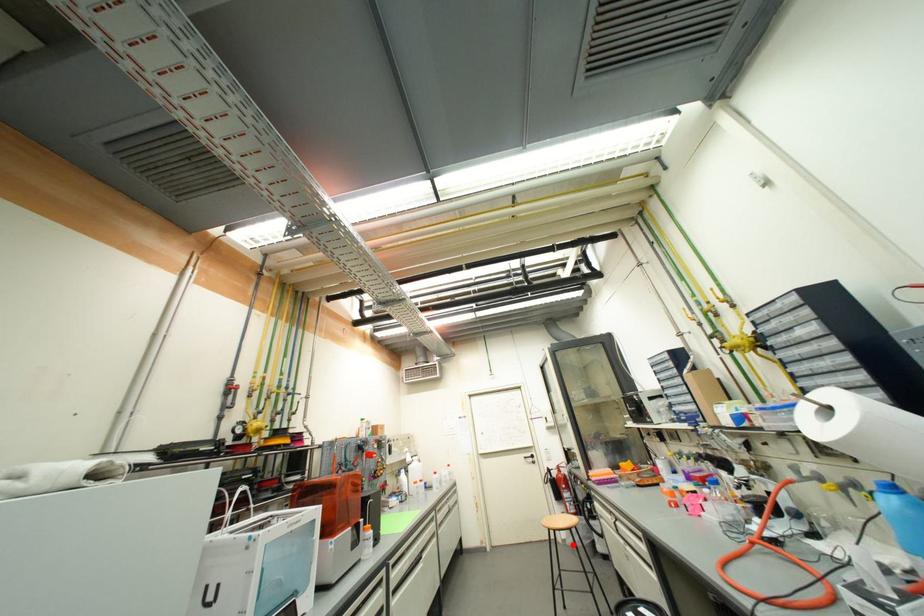
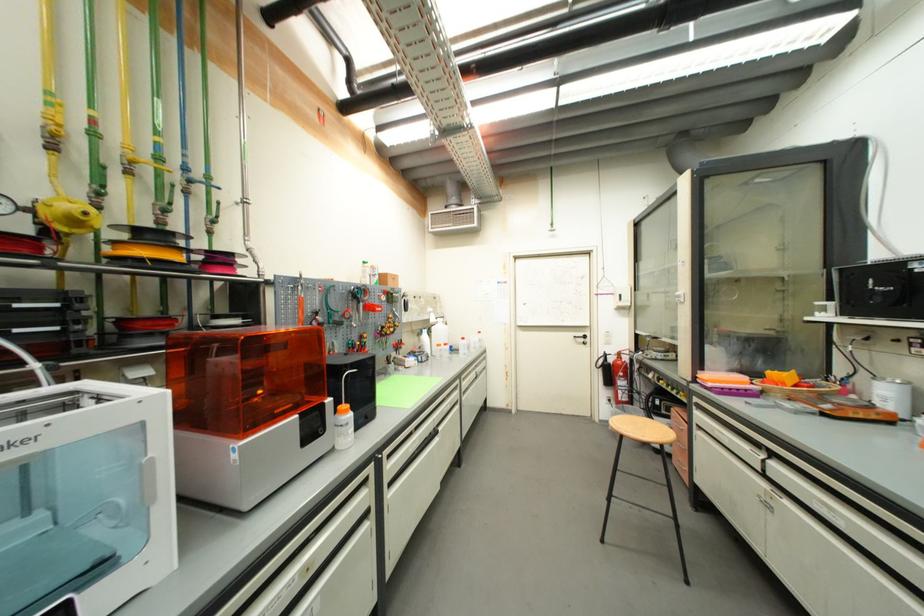
In the second image, find the point that corresponds to the highlighted location in the first image.

(615, 429)